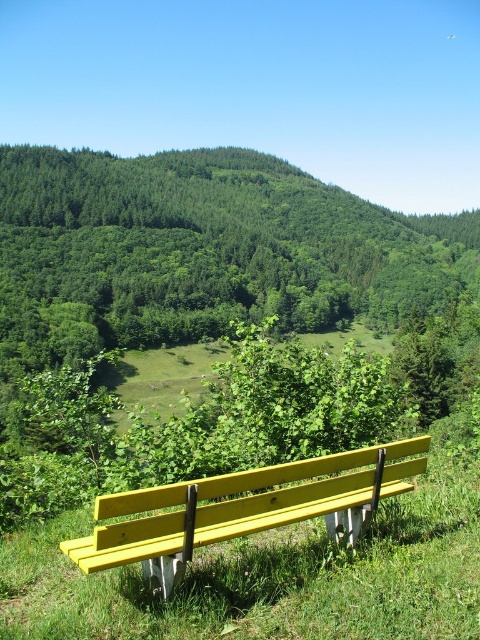
Who is more forward, (222, 275) or (162, 556)?

Point (162, 556) is more forward.

Can you confirm if green leafy tree at center is thinner than yellow painted wood bench at center?

No, green leafy tree at center is not thinner than yellow painted wood bench at center.

Find the location of a particular element. green leafy tree at center is located at coordinates (203, 252).